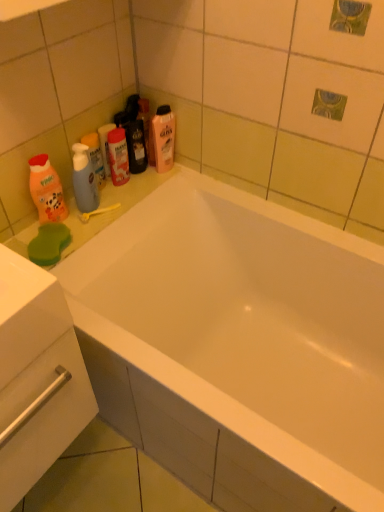
Where is `vacant area located to the right-hand side of orange matte bottle at left, positioned as the first cleaning product in front-to-back order`? vacant area located to the right-hand side of orange matte bottle at left, positioned as the first cleaning product in front-to-back order is located at coordinates (97, 215).